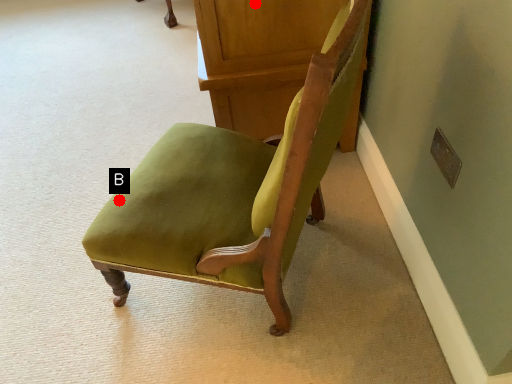
Question: Two points are circled on the image, labeled by A and B beside each circle. Which point is closer to the camera?

Choices:
 (A) A is closer
 (B) B is closer

Answer: (B)